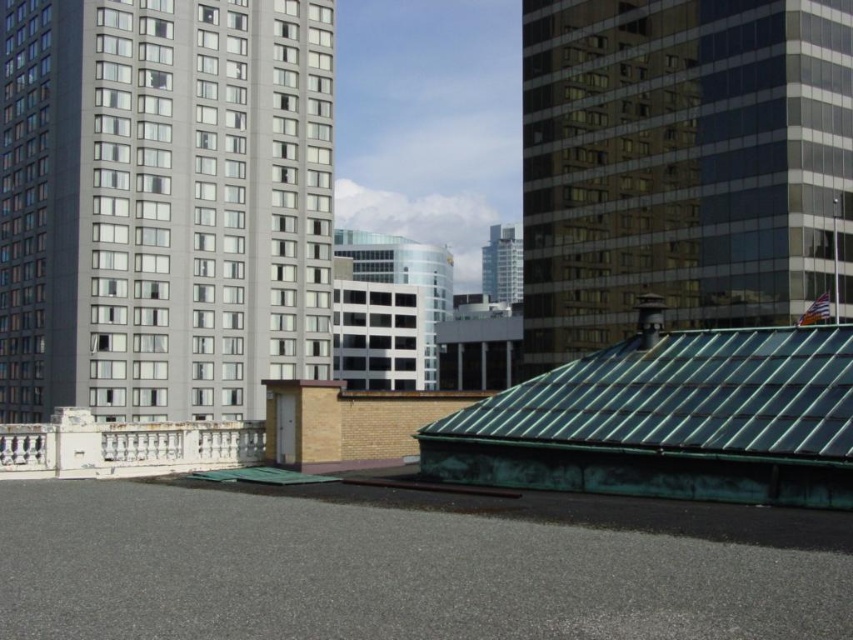
Question: Among these objects, which one is nearest to the camera?

Choices:
 (A) gray concrete building at left
 (B) matte glass skyscraper at center

Answer: (A)

Question: Is the position of white glass building at center more distant than that of matte glass skyscraper at center?

Choices:
 (A) no
 (B) yes

Answer: (A)

Question: Which object is farther from the camera taking this photo?

Choices:
 (A) gray concrete building at left
 (B) green glass roof at upper right

Answer: (A)

Question: Does gray concrete building at left have a greater width compared to green glass roof at upper right?

Choices:
 (A) yes
 (B) no

Answer: (A)

Question: Which point is farther to the camera?

Choices:
 (A) white glass building at center
 (B) gray concrete building at left
 (C) matte glass skyscraper at center
 (D) green glass roof at upper right

Answer: (C)

Question: Considering the relative positions of gray concrete building at left and matte glass skyscraper at center in the image provided, where is gray concrete building at left located with respect to matte glass skyscraper at center?

Choices:
 (A) right
 (B) left

Answer: (B)